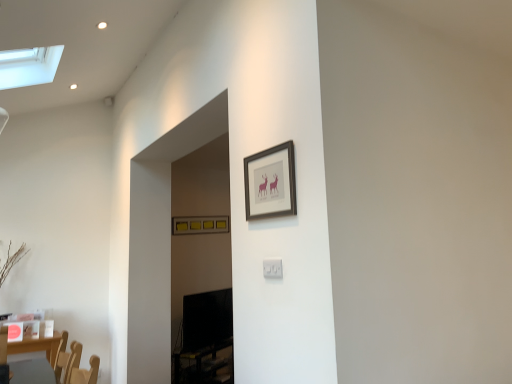
Where is `matte black frame at upper center, the 2th picture frame in the bottom-to-top sequence`? The height and width of the screenshot is (384, 512). matte black frame at upper center, the 2th picture frame in the bottom-to-top sequence is located at coordinates (270, 182).

In order to face white plastic electric outlet at center, should I rotate leftwards or rightwards?

You should rotate right by 2.389 degrees.

Locate an element on the screen. The width and height of the screenshot is (512, 384). matte black frame at upper center, which ranks as the first picture frame in top-to-bottom order is located at coordinates (270, 182).

Is matte yellow picture frame at upper center, positioned as the first picture frame in bottom-to-top order, smaller than matte black frame at upper center, the first picture frame from the right?

Actually, matte yellow picture frame at upper center, positioned as the first picture frame in bottom-to-top order, might be larger than matte black frame at upper center, the first picture frame from the right.

Are matte yellow picture frame at upper center, positioned as the first picture frame in bottom-to-top order, and matte black frame at upper center, the 2th picture frame in the bottom-to-top sequence, located far from each other?

Absolutely, matte yellow picture frame at upper center, positioned as the first picture frame in bottom-to-top order, is distant from matte black frame at upper center, the 2th picture frame in the bottom-to-top sequence.

Between matte yellow picture frame at upper center, acting as the second picture frame starting from the top, and matte black frame at upper center, the 2th picture frame when ordered from left to right, which one has smaller width?

matte black frame at upper center, the 2th picture frame when ordered from left to right.

Is matte yellow picture frame at upper center, the first picture frame from the left, shorter than matte black frame at upper center, the 2th picture frame in the bottom-to-top sequence?

Indeed, matte yellow picture frame at upper center, the first picture frame from the left, has a lesser height compared to matte black frame at upper center, the 2th picture frame in the bottom-to-top sequence.

Between white plastic electric outlet at center and matte yellow picture frame at upper center, which is the second picture frame in front-to-back order, which one has smaller size?

white plastic electric outlet at center is smaller.

Is white plastic electric outlet at center next to matte yellow picture frame at upper center, which is the 1th picture frame in back-to-front order?

No, white plastic electric outlet at center is not making contact with matte yellow picture frame at upper center, which is the 1th picture frame in back-to-front order.

Considering the relative sizes of white plastic electric outlet at center and matte yellow picture frame at upper center, positioned as the first picture frame in bottom-to-top order, in the image provided, is white plastic electric outlet at center thinner than matte yellow picture frame at upper center, positioned as the first picture frame in bottom-to-top order,?

Indeed, white plastic electric outlet at center has a lesser width compared to matte yellow picture frame at upper center, positioned as the first picture frame in bottom-to-top order.

Is matte black frame at upper center, which ranks as the first picture frame in top-to-bottom order, behind matte yellow picture frame at upper center, which is the second picture frame in front-to-back order?

No, the depth of matte black frame at upper center, which ranks as the first picture frame in top-to-bottom order, is less than that of matte yellow picture frame at upper center, which is the second picture frame in front-to-back order.

Would you say matte black frame at upper center, the 2th picture frame when ordered from left to right, is outside matte yellow picture frame at upper center, which is the 1th picture frame in back-to-front order?

That's correct, matte black frame at upper center, the 2th picture frame when ordered from left to right, is outside of matte yellow picture frame at upper center, which is the 1th picture frame in back-to-front order.

Is matte black frame at upper center, which ranks as the first picture frame in top-to-bottom order, to the left of matte yellow picture frame at upper center, which is the second picture frame from right to left, from the viewer's perspective?

No, matte black frame at upper center, which ranks as the first picture frame in top-to-bottom order, is not to the left of matte yellow picture frame at upper center, which is the second picture frame from right to left.

Is matte black frame at upper center, which is counted as the 2th picture frame, starting from the back, beside matte yellow picture frame at upper center, acting as the second picture frame starting from the top?

matte black frame at upper center, which is counted as the 2th picture frame, starting from the back, is not next to matte yellow picture frame at upper center, acting as the second picture frame starting from the top, and they're not touching.

Considering the positions of objects matte black frame at upper center, the 2th picture frame when ordered from left to right, and white plastic electric outlet at center in the image provided, who is more to the left, matte black frame at upper center, the 2th picture frame when ordered from left to right, or white plastic electric outlet at center?

matte black frame at upper center, the 2th picture frame when ordered from left to right.

Does matte black frame at upper center, which ranks as the first picture frame in top-to-bottom order, have a greater width compared to white plastic electric outlet at center?

Yes, matte black frame at upper center, which ranks as the first picture frame in top-to-bottom order, is wider than white plastic electric outlet at center.

From the image's perspective, does matte black frame at upper center, the 2th picture frame when ordered from left to right, appear higher than white plastic electric outlet at center?

Correct, matte black frame at upper center, the 2th picture frame when ordered from left to right, appears higher than white plastic electric outlet at center in the image.

Can you tell me how much matte black frame at upper center, the 2th picture frame when ordered from left to right, and white plastic electric outlet at center differ in facing direction?

There is a 0.432-degree angle between the facing directions of matte black frame at upper center, the 2th picture frame when ordered from left to right, and white plastic electric outlet at center.

Is matte yellow picture frame at upper center, which is the 1th picture frame in back-to-front order, turned away from white plastic electric outlet at center?

No, white plastic electric outlet at center is not at the back of matte yellow picture frame at upper center, which is the 1th picture frame in back-to-front order.

Is matte yellow picture frame at upper center, which is the 1th picture frame in back-to-front order, inside or outside of white plastic electric outlet at center?

matte yellow picture frame at upper center, which is the 1th picture frame in back-to-front order, lies outside white plastic electric outlet at center.

Considering the relative positions of matte yellow picture frame at upper center, which is the second picture frame from right to left, and white plastic electric outlet at center in the image provided, is matte yellow picture frame at upper center, which is the second picture frame from right to left, to the right of white plastic electric outlet at center from the viewer's perspective?

Incorrect, matte yellow picture frame at upper center, which is the second picture frame from right to left, is not on the right side of white plastic electric outlet at center.

From the image's perspective, relative to white plastic electric outlet at center, is matte yellow picture frame at upper center, the first picture frame from the left, above or below?

Based on their image positions, matte yellow picture frame at upper center, the first picture frame from the left, is located beneath white plastic electric outlet at center.

Does white plastic electric outlet at center come in front of matte black frame at upper center, which is counted as the 2th picture frame, starting from the back?

No.

From their relative heights in the image, would you say white plastic electric outlet at center is taller or shorter than matte black frame at upper center, which ranks as the first picture frame in top-to-bottom order?

white plastic electric outlet at center is shorter than matte black frame at upper center, which ranks as the first picture frame in top-to-bottom order.

This screenshot has width=512, height=384. I want to click on picture frame above the matte black frame at upper center, the 2th picture frame in the bottom-to-top sequence (from a real-world perspective), so click(200, 225).

The height and width of the screenshot is (384, 512). In order to click on electric outlet on the right of matte yellow picture frame at upper center, which is the 1th picture frame in back-to-front order in this screenshot , I will do `click(272, 268)`.

From the image, which object appears to be nearer to white plastic electric outlet at center, matte black frame at upper center, the first picture frame from the right, or matte yellow picture frame at upper center, which is the second picture frame in front-to-back order?

matte black frame at upper center, the first picture frame from the right.

Consider the image. When comparing their distances from white plastic electric outlet at center, does matte yellow picture frame at upper center, positioned as the first picture frame in bottom-to-top order, or matte black frame at upper center, which ranks as the first picture frame in top-to-bottom order, seem further?

matte yellow picture frame at upper center, positioned as the first picture frame in bottom-to-top order, is further to white plastic electric outlet at center.

From the image, which object appears to be nearer to matte yellow picture frame at upper center, the first picture frame from the left, matte black frame at upper center, placed as the 1th picture frame when sorted from front to back, or white plastic electric outlet at center?

Based on the image, matte black frame at upper center, placed as the 1th picture frame when sorted from front to back, appears to be nearer to matte yellow picture frame at upper center, the first picture frame from the left.

Consider the image. Based on their spatial positions, is white plastic electric outlet at center or matte black frame at upper center, the 2th picture frame in the bottom-to-top sequence, closer to matte yellow picture frame at upper center, positioned as the first picture frame in bottom-to-top order?

The object closer to matte yellow picture frame at upper center, positioned as the first picture frame in bottom-to-top order, is matte black frame at upper center, the 2th picture frame in the bottom-to-top sequence.

Estimate the real-world distances between objects in this image. Which object is further from matte black frame at upper center, which ranks as the first picture frame in top-to-bottom order, white plastic electric outlet at center or matte yellow picture frame at upper center, which is the second picture frame from right to left?

Based on the image, matte yellow picture frame at upper center, which is the second picture frame from right to left, appears to be further to matte black frame at upper center, which ranks as the first picture frame in top-to-bottom order.

Which object lies further to the anchor point matte black frame at upper center, which is counted as the 2th picture frame, starting from the back, matte yellow picture frame at upper center, which is the second picture frame in front-to-back order, or white plastic electric outlet at center?

The object further to matte black frame at upper center, which is counted as the 2th picture frame, starting from the back, is matte yellow picture frame at upper center, which is the second picture frame in front-to-back order.

Find the location of a particular element. electric outlet between matte black frame at upper center, the 2th picture frame when ordered from left to right, and matte yellow picture frame at upper center, acting as the second picture frame starting from the top, in the front-back direction is located at coordinates (272, 268).